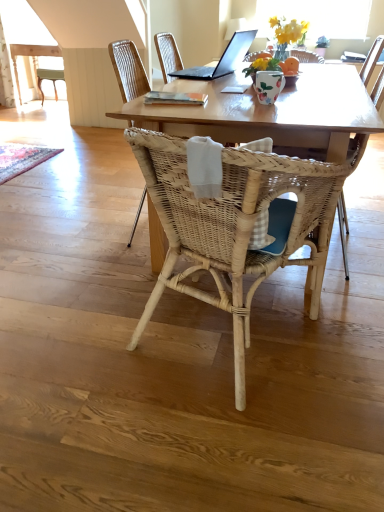
In order to click on vacant space situated above rustic woven mat at lower left (from a real-world perspective) in this screenshot , I will do `click(21, 153)`.